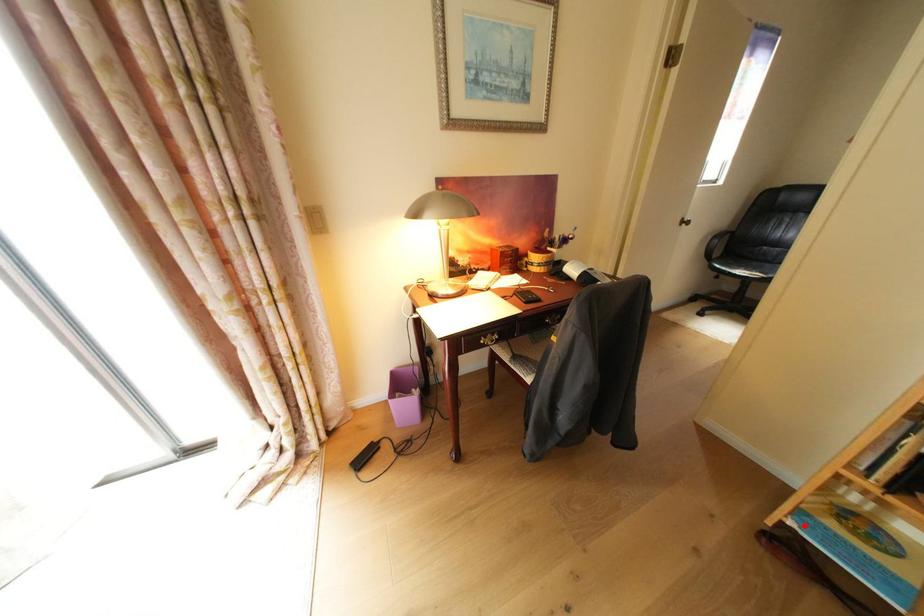
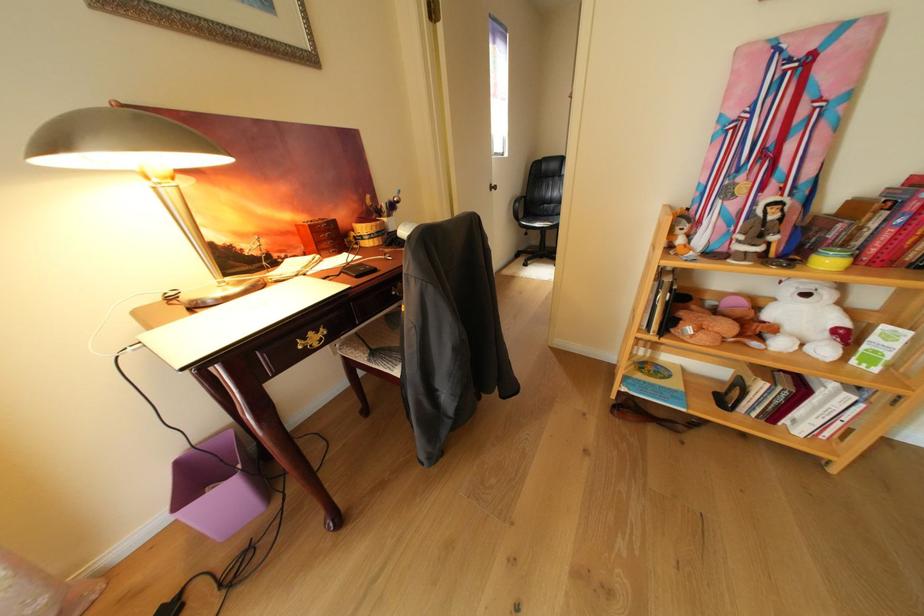
Find the pixel in the second image that matches the highlighted location in the first image.

(638, 391)